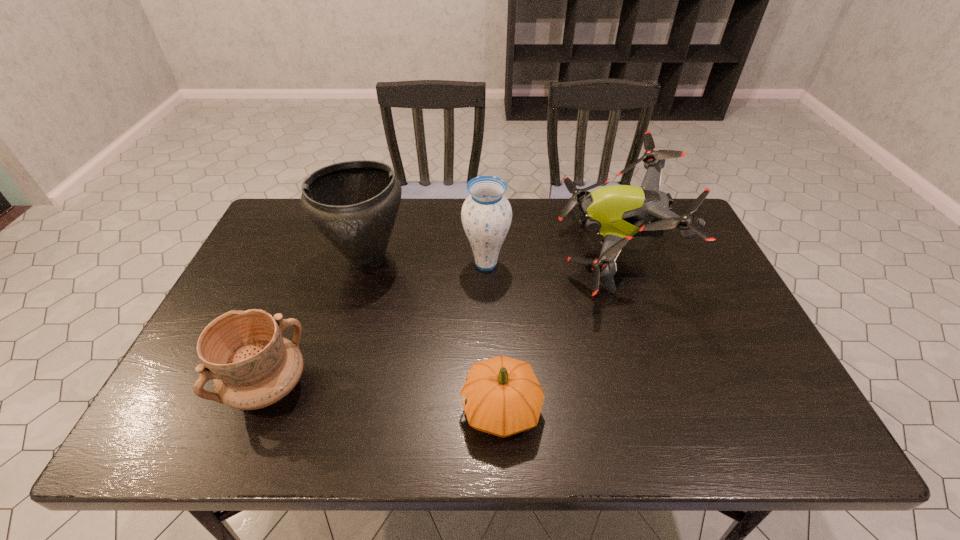
Locate an element on the screen. The image size is (960, 540). vacant space located on the back of the pottery is located at coordinates (317, 265).

Where is `vacant point located 0.350m on the side of the shortest object with the carved face`? Image resolution: width=960 pixels, height=540 pixels. vacant point located 0.350m on the side of the shortest object with the carved face is located at coordinates 300,409.

The image size is (960, 540). In order to click on free region located 0.270m on the side of the shortest object with the carved face in this screenshot , I will do `click(337, 409)`.

Where is `vacant space situated on the side of the shortest object with the carved face`? The image size is (960, 540). vacant space situated on the side of the shortest object with the carved face is located at coordinates (428, 409).

The height and width of the screenshot is (540, 960). Identify the location of drone that is positioned at the far edge. (617, 213).

This screenshot has height=540, width=960. Identify the location of urn located in the far edge section of the desktop. (354, 204).

Where is `pottery that is at the near edge`? The height and width of the screenshot is (540, 960). pottery that is at the near edge is located at coordinates (252, 366).

I want to click on gourd that is at the near edge, so (501, 396).

Find the location of a particular element. The width and height of the screenshot is (960, 540). object situated at the left edge is located at coordinates (252, 366).

The image size is (960, 540). I want to click on object that is positioned at the right edge, so click(x=617, y=213).